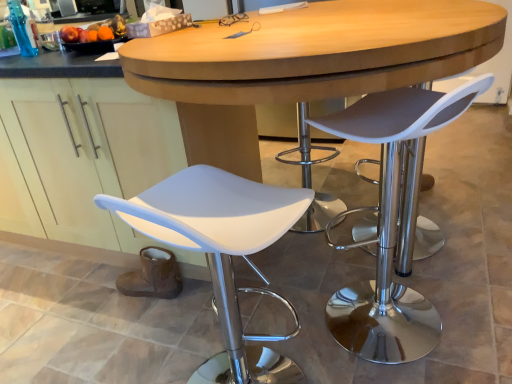
Where is `vacant area that lies between white matte chair at lower left, which is the 2th chair in right-to-left order, and matte gray seat at right, which is counted as the first chair, starting from the right`? This screenshot has height=384, width=512. vacant area that lies between white matte chair at lower left, which is the 2th chair in right-to-left order, and matte gray seat at right, which is counted as the first chair, starting from the right is located at coordinates (304, 333).